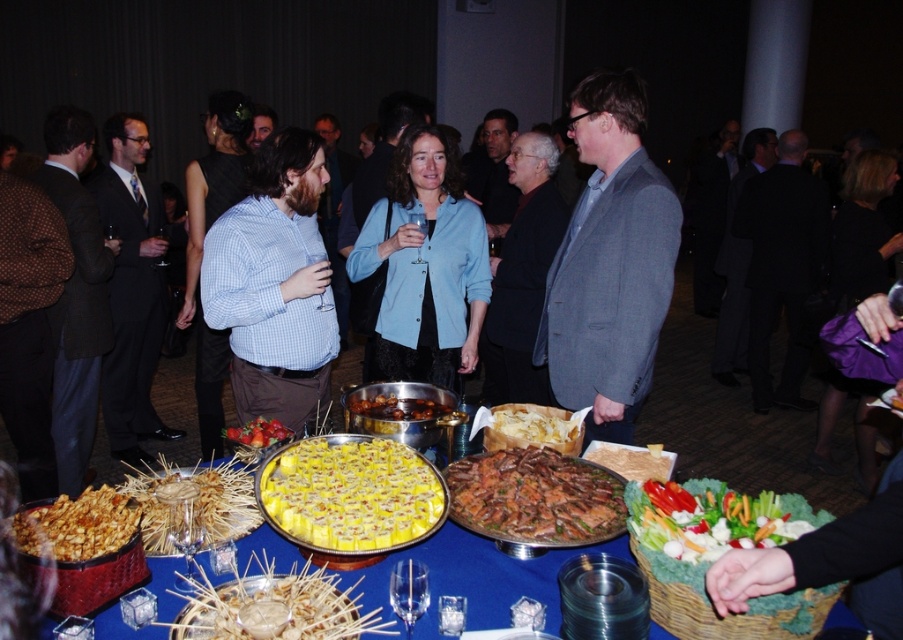
You are a guest at the party and want to grab a drink from the transparent glass at center and some nuts from the brown glossy nuts at center. Which item is wider?

The transparent glass at center has a lesser width compared to brown glossy nuts at center, so the brown glossy nuts at center is wider.

You are a guest at the party and want to grab a drink from the table. There is a transparent glass at center and brown glossy nuts at center. Which item is taller?

The transparent glass at center is much taller than the brown glossy nuts at center, so the transparent glass at center is taller.

You are a guest at this event and want to grab a drink from the transparent glass at center without touching the yellow cheese bread at center. Is this possible?

The yellow cheese bread at center is further to the viewer than the transparent glass at center, so the glass is behind the bread. You can reach the glass by moving around the bread or approaching from the side to avoid contact.